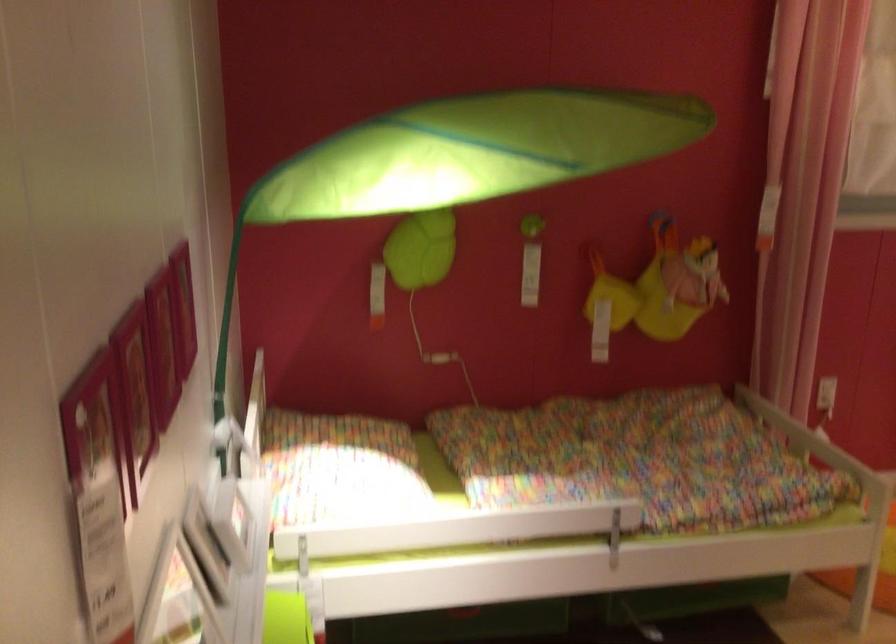
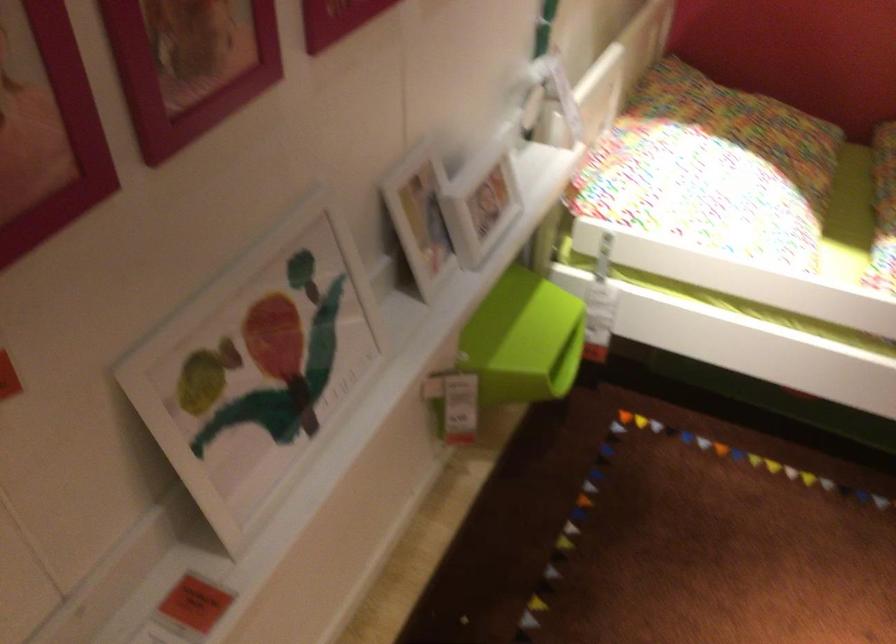
First-person continuous shooting, in which direction is the camera rotating?

The camera rotated toward left-down.